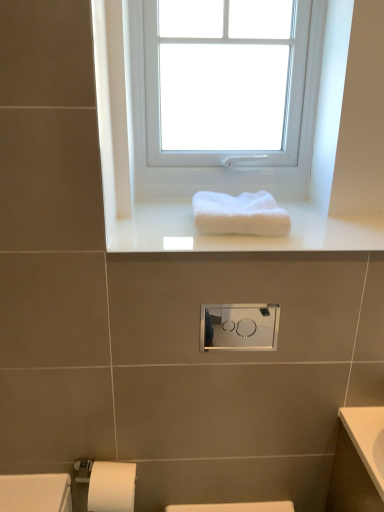
I want to click on vacant region above white glossy towel at upper center (from a real-world perspective), so (251, 238).